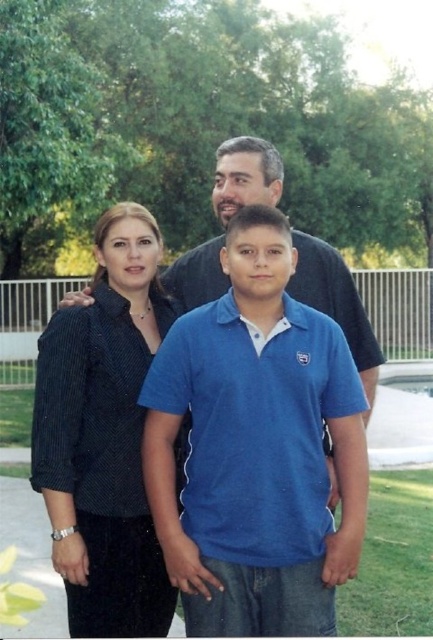
Does blue cotton shirt at center appear on the left side of dark blue striped shirt at left?

Incorrect, blue cotton shirt at center is not on the left side of dark blue striped shirt at left.

Between blue cotton shirt at center and dark blue striped shirt at left, which one is positioned higher?

blue cotton shirt at center is above.

The image size is (433, 640). What do you see at coordinates (255, 449) in the screenshot?
I see `blue cotton shirt at center` at bounding box center [255, 449].

At what (x,y) coordinates should I click in order to perform the action: click on blue cotton shirt at center. Please return your answer as a coordinate pair (x, y). Looking at the image, I should click on (255, 449).